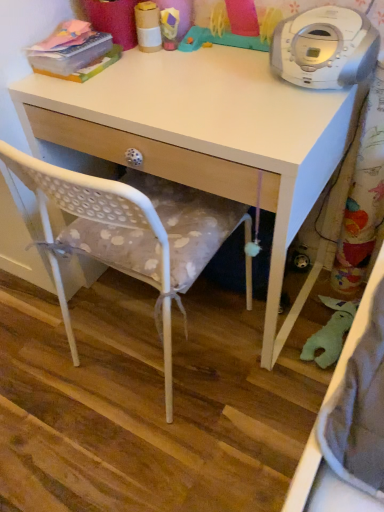
Question: Is rubber duck at upper center, which is the first toy from right to left, thinner than white plastic cd player at upper right?

Choices:
 (A) no
 (B) yes

Answer: (B)

Question: Is the surface of rubber duck at upper center, which ranks as the 2th toy in left-to-right order, in direct contact with white plastic cd player at upper right?

Choices:
 (A) no
 (B) yes

Answer: (A)

Question: Considering the relative positions of rubber duck at upper center, which is the first toy from right to left, and white plastic cd player at upper right in the image provided, is rubber duck at upper center, which is the first toy from right to left, behind white plastic cd player at upper right?

Choices:
 (A) no
 (B) yes

Answer: (B)

Question: Is rubber duck at upper center, which is the first toy from right to left, wider than white plastic cd player at upper right?

Choices:
 (A) yes
 (B) no

Answer: (B)

Question: Considering the relative sizes of rubber duck at upper center, which ranks as the 2th toy in left-to-right order, and white plastic cd player at upper right in the image provided, is rubber duck at upper center, which ranks as the 2th toy in left-to-right order, smaller than white plastic cd player at upper right?

Choices:
 (A) no
 (B) yes

Answer: (B)

Question: From the image's perspective, relative to white matte desk at center, is white plastic cd player at upper right above or below?

Choices:
 (A) above
 (B) below

Answer: (A)

Question: Considering the positions of white plastic cd player at upper right and white matte desk at center in the image, is white plastic cd player at upper right wider or thinner than white matte desk at center?

Choices:
 (A) wide
 (B) thin

Answer: (B)

Question: Relative to white matte desk at center, is white plastic cd player at upper right in front or behind?

Choices:
 (A) front
 (B) behind

Answer: (B)

Question: From a real-world perspective, is white plastic cd player at upper right positioned above or below white matte desk at center?

Choices:
 (A) above
 (B) below

Answer: (A)

Question: Looking at the image, does white plastic cd player at upper right seem bigger or smaller compared to white polka dot fabric chair at center?

Choices:
 (A) big
 (B) small

Answer: (B)

Question: Which is correct: white plastic cd player at upper right is inside white polka dot fabric chair at center, or outside of it?

Choices:
 (A) inside
 (B) outside

Answer: (B)

Question: In terms of height, does white plastic cd player at upper right look taller or shorter compared to white polka dot fabric chair at center?

Choices:
 (A) short
 (B) tall

Answer: (A)

Question: From a real-world perspective, is white plastic cd player at upper right above or below white polka dot fabric chair at center?

Choices:
 (A) below
 (B) above

Answer: (B)

Question: Is point (319, 8) positioned closer to the camera than point (157, 10)?

Choices:
 (A) farther
 (B) closer

Answer: (B)

Question: From their relative heights in the image, would you say white plastic cd player at upper right is taller or shorter than cardboard tube at upper center, which is the 2th toy in right-to-left order?

Choices:
 (A) tall
 (B) short

Answer: (A)